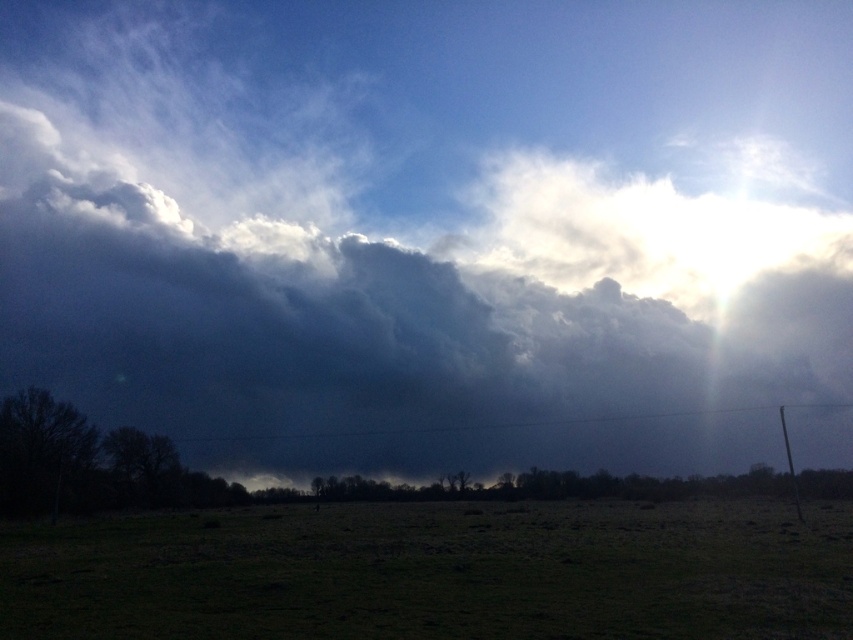
Based on the photo, you are standing in the open field and looking up at the sky. Which object, the dark gray cloud at upper center or the green grass at lower center, takes up more space in the sky?

The dark gray cloud at upper center takes up more space in the sky than the green grass at lower center because it is bigger.

You are standing in the open field and want to reach the point marked at coordinates point (x=524, y=170). If your walking speed is 1.5 meters per second, how many seconds will it take you to reach that point?

The point (x=524, y=170) is 177.40 meters away from the camera. At a walking speed of 1.5 meters per second, it would take approximately 118.27 seconds to reach it.